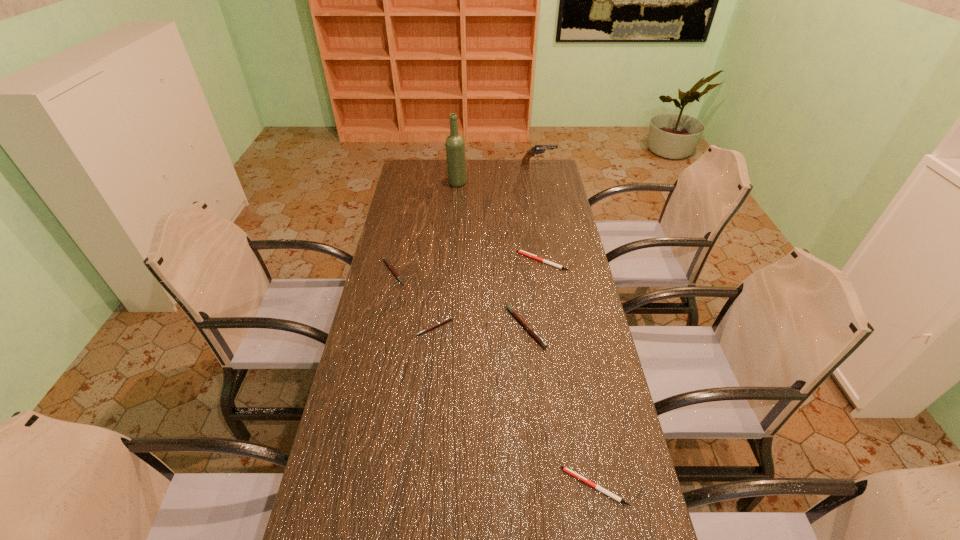
In order to click on vacant point located between the leftmost object and the smallest pink pen in this screenshot , I will do `click(415, 300)`.

Find the location of a particular element. the fourth closest object to the smallest pink pen is located at coordinates (619, 499).

Find the location of `the closest object relative to the sixth shortest object`. the closest object relative to the sixth shortest object is located at coordinates (455, 151).

Where is `pen that is the nearest to the second smallest pink pen`? The width and height of the screenshot is (960, 540). pen that is the nearest to the second smallest pink pen is located at coordinates (450, 318).

This screenshot has height=540, width=960. Find the location of `pen that is the fifth closest to the green wine bottle`. pen that is the fifth closest to the green wine bottle is located at coordinates (619, 499).

Identify the location of pink pen identified as the closest to the leftmost pen. This screenshot has height=540, width=960. (450, 318).

At what (x,y) coordinates should I click in order to perform the action: click on pink pen that stands as the closest to the farther white pen. Please return your answer as a coordinate pair (x, y). Looking at the image, I should click on (536, 336).

Image resolution: width=960 pixels, height=540 pixels. Find the location of `vacant region that satisfies the following two spatial constraints: 1. on the clicker of the bigger white pen; 2. at the nib of the smallest pink pen`. vacant region that satisfies the following two spatial constraints: 1. on the clicker of the bigger white pen; 2. at the nib of the smallest pink pen is located at coordinates (553, 327).

This screenshot has height=540, width=960. I want to click on vacant space that satisfies the following two spatial constraints: 1. on the clicker of the farther white pen; 2. at the nib of the smallest pink pen, so click(553, 327).